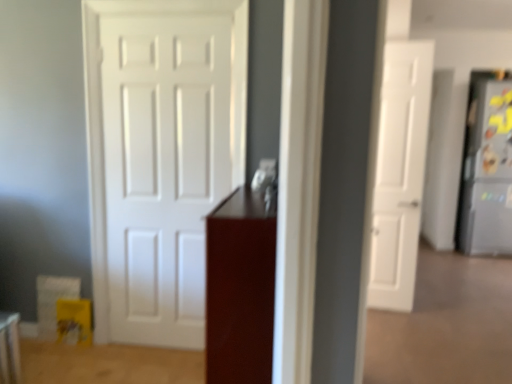
Question: Can we say satin silver refrigerator at right lies outside glossy wood cabinet at center?

Choices:
 (A) yes
 (B) no

Answer: (A)

Question: From a real-world perspective, is satin silver refrigerator at right over glossy wood cabinet at center?

Choices:
 (A) no
 (B) yes

Answer: (B)

Question: Can you confirm if satin silver refrigerator at right is smaller than glossy wood cabinet at center?

Choices:
 (A) no
 (B) yes

Answer: (A)

Question: Could you tell me if satin silver refrigerator at right is facing glossy wood cabinet at center?

Choices:
 (A) no
 (B) yes

Answer: (A)

Question: Is satin silver refrigerator at right positioned behind glossy wood cabinet at center?

Choices:
 (A) no
 (B) yes

Answer: (B)

Question: Does point (506, 102) appear closer or farther from the camera than point (378, 279)?

Choices:
 (A) closer
 (B) farther

Answer: (B)

Question: Would you say satin silver refrigerator at right is to the left or to the right of white matte door at right, positioned as the first door in right-to-left order, in the picture?

Choices:
 (A) right
 (B) left

Answer: (A)

Question: In the image, is satin silver refrigerator at right positioned in front of or behind white matte door at right, the second door when ordered from left to right?

Choices:
 (A) front
 (B) behind

Answer: (B)

Question: From the image's perspective, is satin silver refrigerator at right positioned above or below white matte door at right, acting as the first door starting from the back?

Choices:
 (A) below
 (B) above

Answer: (B)

Question: Is white matte door at center, positioned as the 1th door in front-to-back order, taller or shorter than white matte door at right, acting as the first door starting from the back?

Choices:
 (A) tall
 (B) short

Answer: (A)

Question: In the image, is white matte door at center, placed as the 2th door when sorted from right to left, positioned in front of or behind white matte door at right, the second door when ordered from left to right?

Choices:
 (A) behind
 (B) front

Answer: (B)

Question: From the image's perspective, is white matte door at center, the second door when ordered from back to front, positioned above or below white matte door at right, the second door in the front-to-back sequence?

Choices:
 (A) below
 (B) above

Answer: (A)

Question: Would you say white matte door at center, positioned as the 1th door in left-to-right order, is to the left or to the right of white matte door at right, the second door when ordered from left to right, in the picture?

Choices:
 (A) right
 (B) left

Answer: (B)

Question: Is point (187, 66) closer or farther from the camera than point (477, 109)?

Choices:
 (A) closer
 (B) farther

Answer: (A)

Question: From the image's perspective, relative to satin silver refrigerator at right, is white matte door at center, positioned as the 1th door in left-to-right order, above or below?

Choices:
 (A) below
 (B) above

Answer: (A)